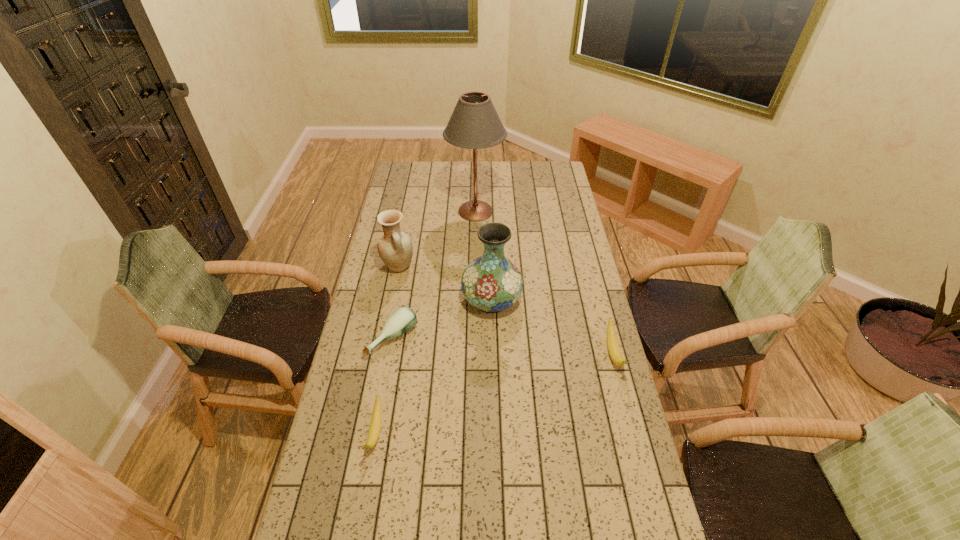
Where is `the nearer banana`? The height and width of the screenshot is (540, 960). the nearer banana is located at coordinates (375, 424).

I want to click on the shorter banana, so click(x=375, y=424).

Where is `the rightmost object`? Image resolution: width=960 pixels, height=540 pixels. the rightmost object is located at coordinates tap(613, 346).

The width and height of the screenshot is (960, 540). I want to click on the right banana, so click(x=613, y=346).

The width and height of the screenshot is (960, 540). In order to click on pottery in this screenshot , I will do `click(395, 248)`.

Find the location of `table lamp`. table lamp is located at coordinates (474, 124).

Identify the location of the farthest object. (474, 124).

Image resolution: width=960 pixels, height=540 pixels. What are the coordinates of `the fifth shortest object` in the screenshot? It's located at (492, 283).

The height and width of the screenshot is (540, 960). What are the coordinates of `bottle` in the screenshot? It's located at (403, 319).

You are a GUI agent. You are given a task and a screenshot of the screen. Output one action in this format:
    pyautogui.click(x=<x>, y=<y>)
    Task: Click on the free point located at the stem of the left banana
    The height and width of the screenshot is (540, 960).
    Given the screenshot: What is the action you would take?
    pyautogui.click(x=367, y=481)